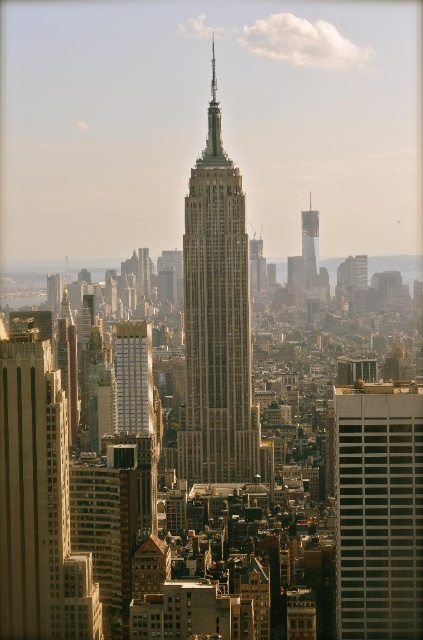
You are an urban planner analyzing the city layout. You need to determine which of the two buildings, the beige stone tower at center or the gray concrete building at right, has a smaller footprint. Based on the scene, which one would you conclude?

The beige stone tower at center is thinner than the gray concrete building at right, so it likely has a smaller footprint.

From the picture: You are a city planner analyzing the layout of this area. Given the presence of the gray concrete building at right and the smooth concrete skyscraper at center, which one has a greater horizontal span from left to right?

The gray concrete building at right might be wider than smooth concrete skyscraper at center.